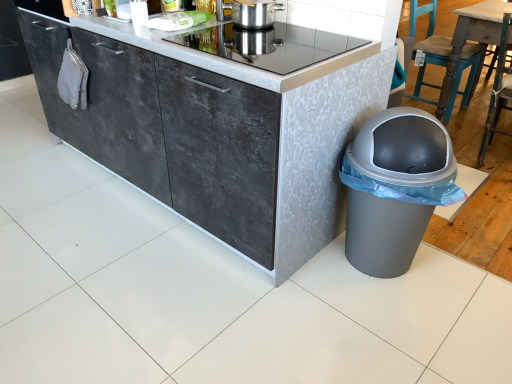
Identify the location of free location in front of dark gray concrete cabinet at center. The image size is (512, 384). coord(201,311).